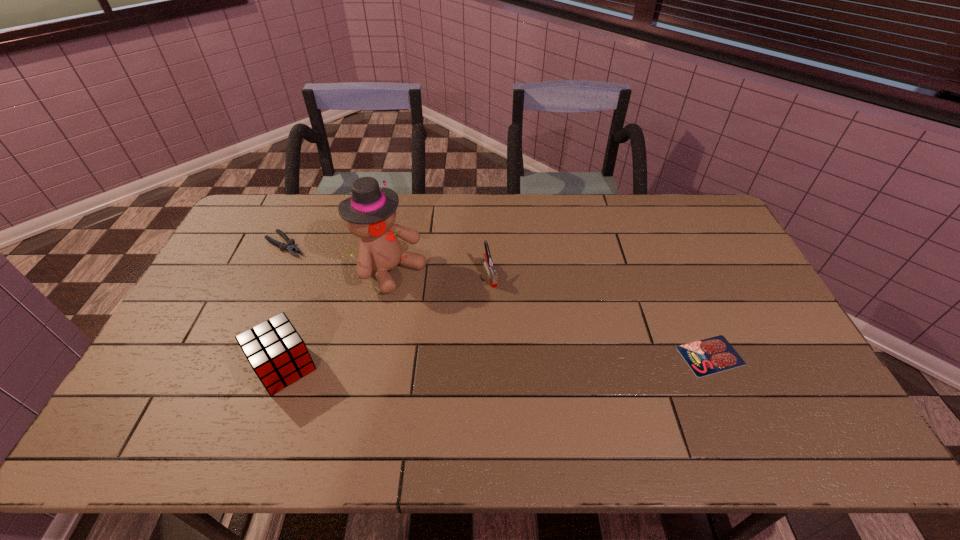
Identify the location of vacant position located 0.250m on the front-facing side of the third object from right to left. The width and height of the screenshot is (960, 540). (483, 323).

This screenshot has height=540, width=960. Identify the location of vacant space located 0.310m on the front-facing side of the third object from right to left. (500, 333).

Find the location of a particular element. Image resolution: width=960 pixels, height=540 pixels. vacant space situated 0.050m on the front-facing side of the third object from right to left is located at coordinates (430, 293).

The image size is (960, 540). What are the coordinates of `vacant space located 0.170m on the handle side of the stapler` in the screenshot? It's located at (509, 329).

Locate an element on the screen. The width and height of the screenshot is (960, 540). vacant region located on the handle side of the stapler is located at coordinates (514, 340).

Locate an element on the screen. free space located on the handle side of the stapler is located at coordinates (509, 329).

Where is `vacant area situated 0.210m at the gripping part of the pliers`? The image size is (960, 540). vacant area situated 0.210m at the gripping part of the pliers is located at coordinates (339, 283).

Where is `vacant space located at the gripping part of the pliers`? This screenshot has width=960, height=540. vacant space located at the gripping part of the pliers is located at coordinates (341, 285).

Find the location of a particular element. This screenshot has width=960, height=540. free space located at the gripping part of the pliers is located at coordinates (360, 299).

Locate an element on the screen. This screenshot has height=540, width=960. object that is at the far edge is located at coordinates (290, 247).